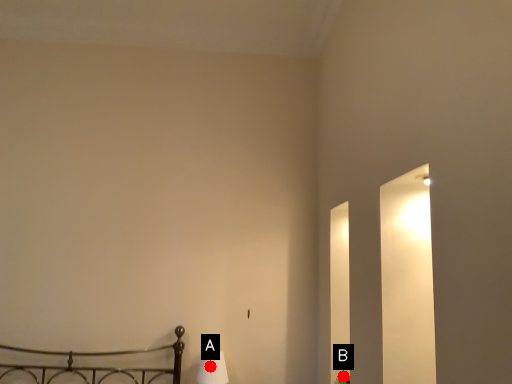
Question: Two points are circled on the image, labeled by A and B beside each circle. Which point is farther to the camera?

Choices:
 (A) A is further
 (B) B is further

Answer: (A)